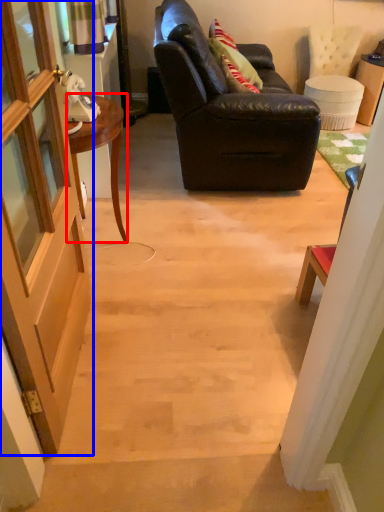
Question: Which point is further to the camera, desk (highlighted by a red box) or door (highlighted by a blue box)?

Choices:
 (A) desk
 (B) door

Answer: (A)